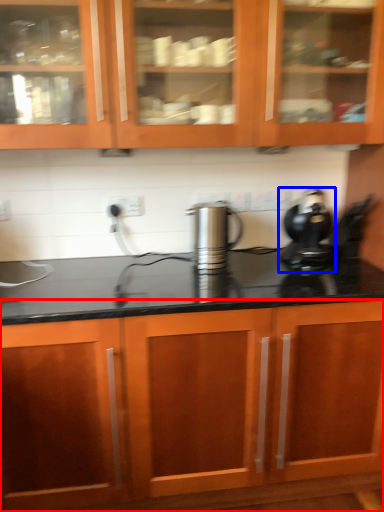
Question: Which object is further to the camera taking this photo, cabinetry (highlighted by a red box) or home appliance (highlighted by a blue box)?

Choices:
 (A) cabinetry
 (B) home appliance

Answer: (B)